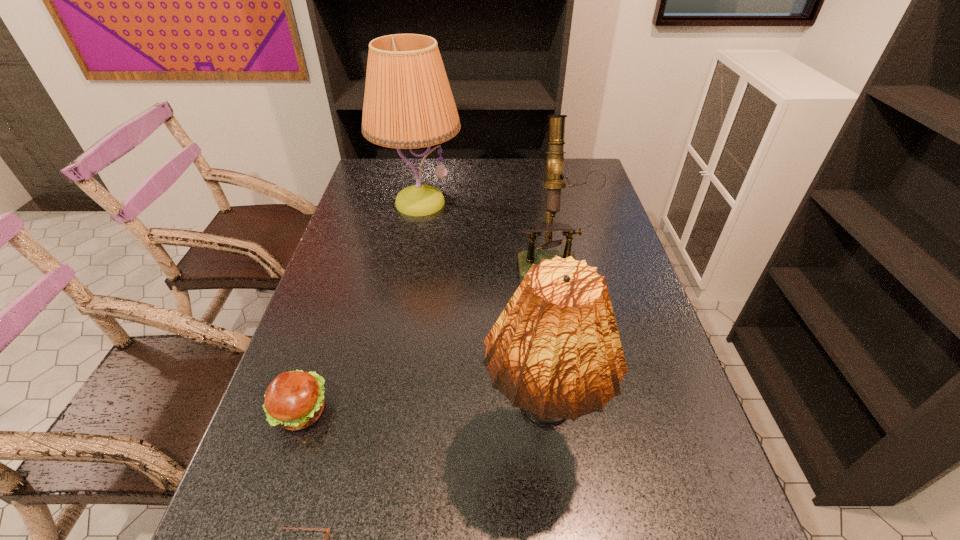
At what (x,y) coordinates should I click in order to perform the action: click on lamp. Please return your answer as a coordinate pair (x, y). This screenshot has height=540, width=960. Looking at the image, I should click on (408, 103).

The image size is (960, 540). In order to click on lampshade in this screenshot , I will do `click(555, 351)`.

This screenshot has width=960, height=540. In order to click on microscope in this screenshot , I will do `click(596, 179)`.

The height and width of the screenshot is (540, 960). What are the coordinates of `hamburger` in the screenshot? It's located at (294, 400).

Where is `vacant region located 0.270m on the side of the lamp near the pull switch`? vacant region located 0.270m on the side of the lamp near the pull switch is located at coordinates (404, 285).

Identify the location of vacant space located 0.270m at the eyepiece of the fourth nearest object. The width and height of the screenshot is (960, 540). (571, 361).

Where is `free region located on the front of the second shortest object`? This screenshot has height=540, width=960. free region located on the front of the second shortest object is located at coordinates (267, 511).

At what (x,y) coordinates should I click in order to perform the action: click on object situated at the far edge. Please return your answer as a coordinate pair (x, y). Image resolution: width=960 pixels, height=540 pixels. Looking at the image, I should click on (408, 103).

Identify the location of lamp at the left edge. (408, 103).

The height and width of the screenshot is (540, 960). Find the location of `hamburger that is at the left edge`. hamburger that is at the left edge is located at coordinates (294, 400).